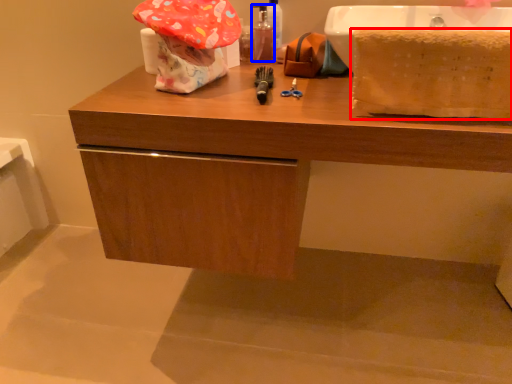
Question: Among these objects, which one is farthest to the camera, blanket (highlighted by a red box) or mouthwash (highlighted by a blue box)?

Choices:
 (A) blanket
 (B) mouthwash

Answer: (B)